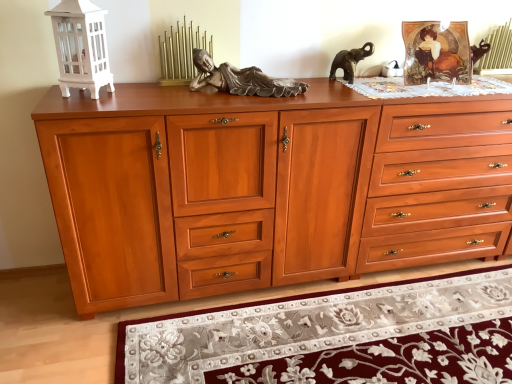
Question: Is cherry wood chest of drawers at center at the back of satin wood drawer at center, the 2th drawer from the right?

Choices:
 (A) no
 (B) yes

Answer: (B)

Question: Does satin wood drawer at center, arranged as the first drawer when viewed from the left, have a greater height compared to cherry wood chest of drawers at center?

Choices:
 (A) yes
 (B) no

Answer: (B)

Question: Does satin wood drawer at center, the 2th drawer from the right, have a lesser height compared to cherry wood chest of drawers at center?

Choices:
 (A) no
 (B) yes

Answer: (B)

Question: From the image's perspective, is satin wood drawer at center, arranged as the first drawer when viewed from the left, beneath cherry wood chest of drawers at center?

Choices:
 (A) yes
 (B) no

Answer: (B)

Question: Is satin wood drawer at center, arranged as the first drawer when viewed from the left, next to cherry wood chest of drawers at center and touching it?

Choices:
 (A) no
 (B) yes

Answer: (A)

Question: Considering the relative sizes of satin wood drawer at center, arranged as the first drawer when viewed from the left, and cherry wood chest of drawers at center in the image provided, is satin wood drawer at center, arranged as the first drawer when viewed from the left, smaller than cherry wood chest of drawers at center?

Choices:
 (A) no
 (B) yes

Answer: (B)

Question: Can you confirm if floral rug at lower center is shorter than satin wood drawer at center, arranged as the first drawer when viewed from the left?

Choices:
 (A) yes
 (B) no

Answer: (A)

Question: From a real-world perspective, is floral rug at lower center physically above satin wood drawer at center, arranged as the first drawer when viewed from the left?

Choices:
 (A) yes
 (B) no

Answer: (B)

Question: Is floral rug at lower center wider than satin wood drawer at center, arranged as the first drawer when viewed from the left?

Choices:
 (A) yes
 (B) no

Answer: (A)

Question: Would you say floral rug at lower center contains satin wood drawer at center, arranged as the first drawer when viewed from the left?

Choices:
 (A) no
 (B) yes

Answer: (A)

Question: Can we say floral rug at lower center lies outside satin wood drawer at center, arranged as the first drawer when viewed from the left?

Choices:
 (A) yes
 (B) no

Answer: (A)

Question: Is floral rug at lower center positioned in front of satin wood drawer at center, arranged as the first drawer when viewed from the left?

Choices:
 (A) no
 (B) yes

Answer: (B)

Question: Is cherry wood chest of drawers at center thinner than satin wood drawer at center, the 2th drawer from the right?

Choices:
 (A) no
 (B) yes

Answer: (A)